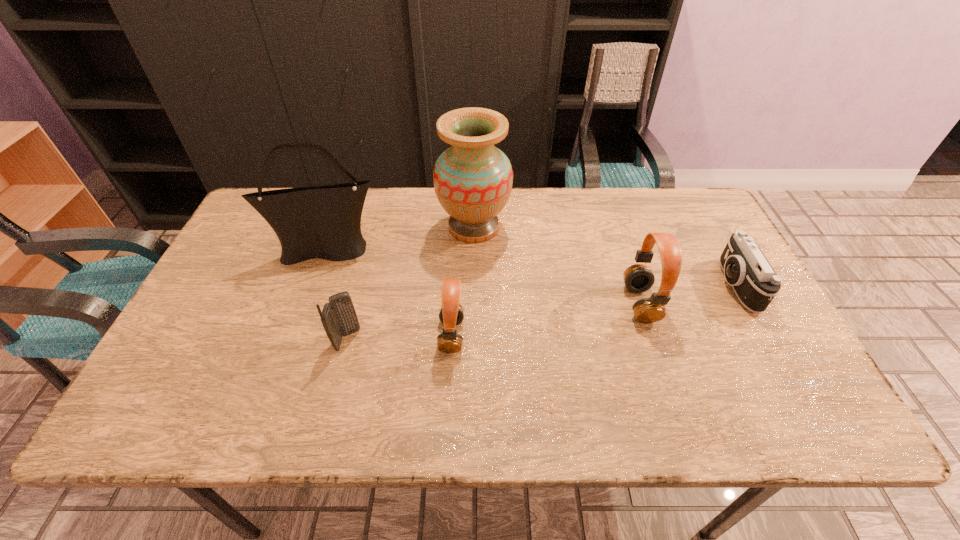
Where is `object located in the far edge section of the desktop`? This screenshot has height=540, width=960. object located in the far edge section of the desktop is located at coordinates (473, 179).

In order to click on object located in the near edge section of the desktop in this screenshot , I will do `click(451, 314)`.

This screenshot has height=540, width=960. Find the location of `object that is at the left edge`. object that is at the left edge is located at coordinates (324, 222).

Identify the location of object located at the right edge. (755, 283).

Identify the location of free space at the far edge. (432, 195).

In the image, there is a desktop. Where is `vacant space at the near edge`? This screenshot has height=540, width=960. vacant space at the near edge is located at coordinates (414, 383).

Identify the location of free point at the left edge. The image size is (960, 540). (256, 278).

The height and width of the screenshot is (540, 960). Find the location of `free region at the right edge of the desktop`. free region at the right edge of the desktop is located at coordinates (727, 289).

In the image, there is a desktop. Where is `vacant space at the far right corner`? The height and width of the screenshot is (540, 960). vacant space at the far right corner is located at coordinates (679, 207).

This screenshot has height=540, width=960. In order to click on vacant area between the vase and the right headset in this screenshot , I will do `click(557, 265)`.